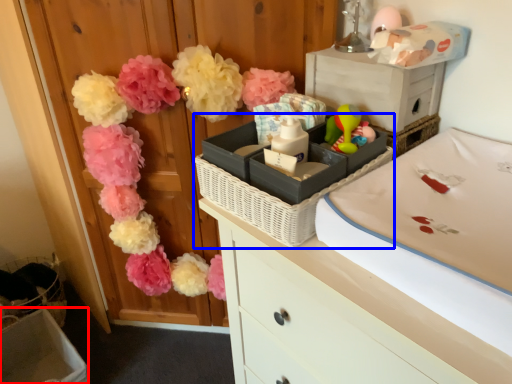
Question: Which point is further to the camera, storage box (highlighted by a red box) or basket container (highlighted by a blue box)?

Choices:
 (A) storage box
 (B) basket container

Answer: (A)